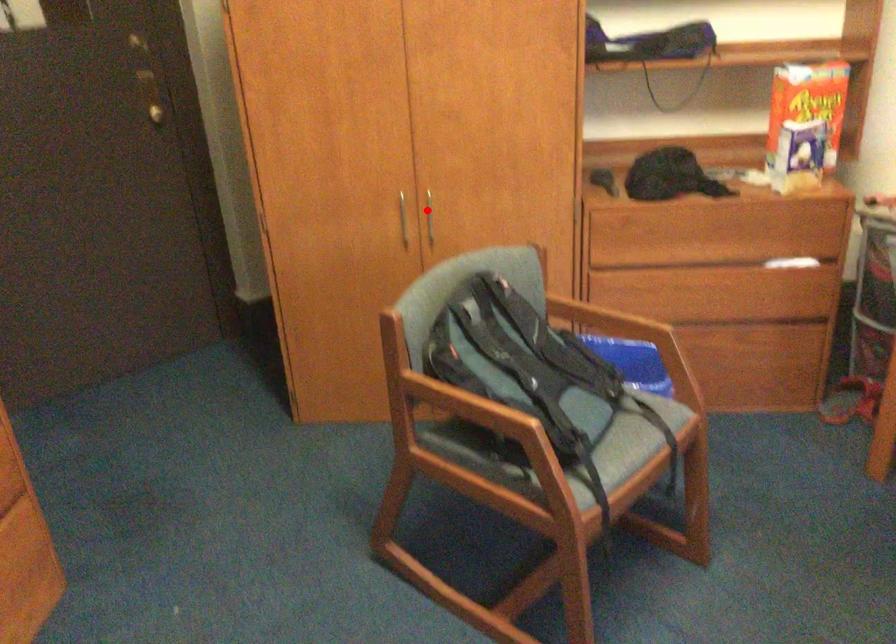
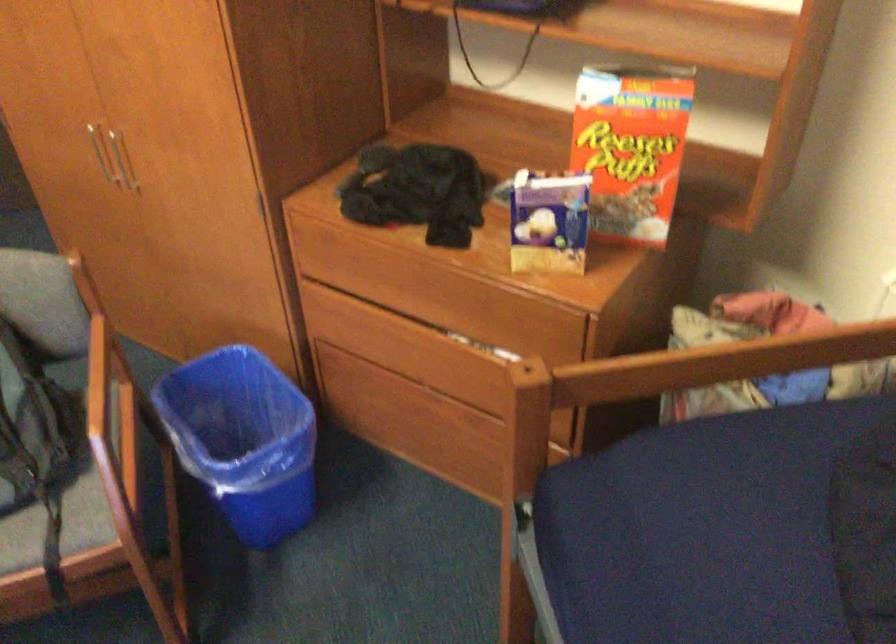
Locate, in the second image, the point that corresponds to the highlighted location in the first image.

(122, 160)